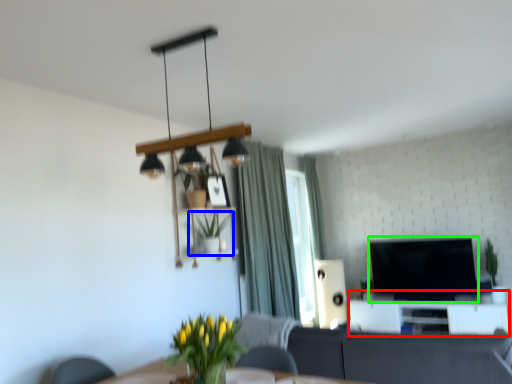
Question: Which is nearer to the entertainment center (highlighted by a red box)? houseplant (highlighted by a blue box) or television (highlighted by a green box).

Choices:
 (A) houseplant
 (B) television

Answer: (B)